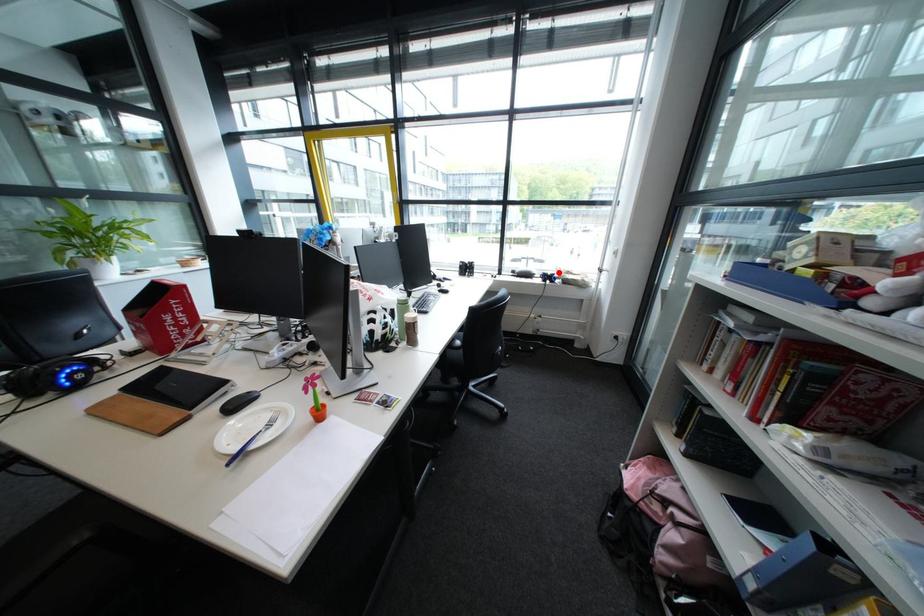
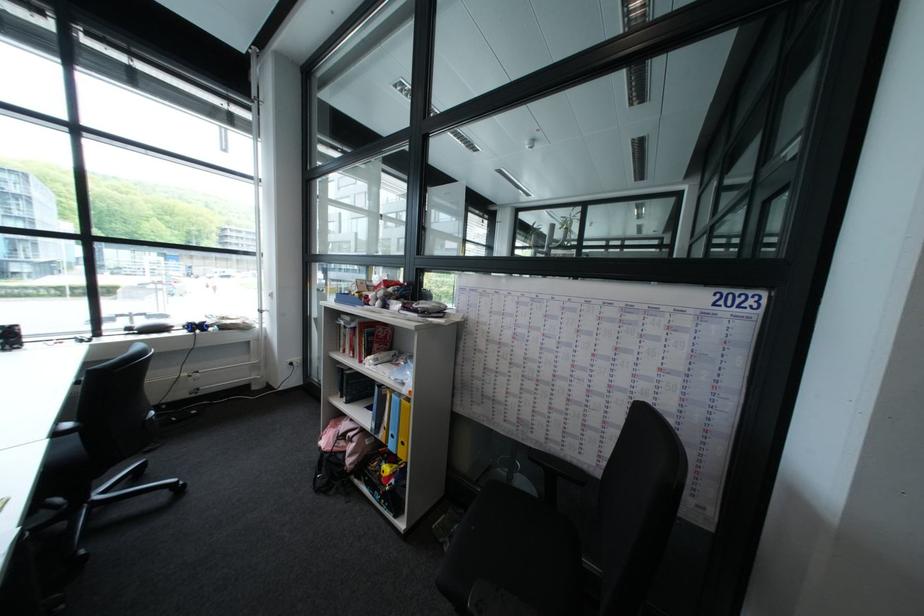
Find the pixel in the second image that matches the highlighted location in the first image.

(203, 322)